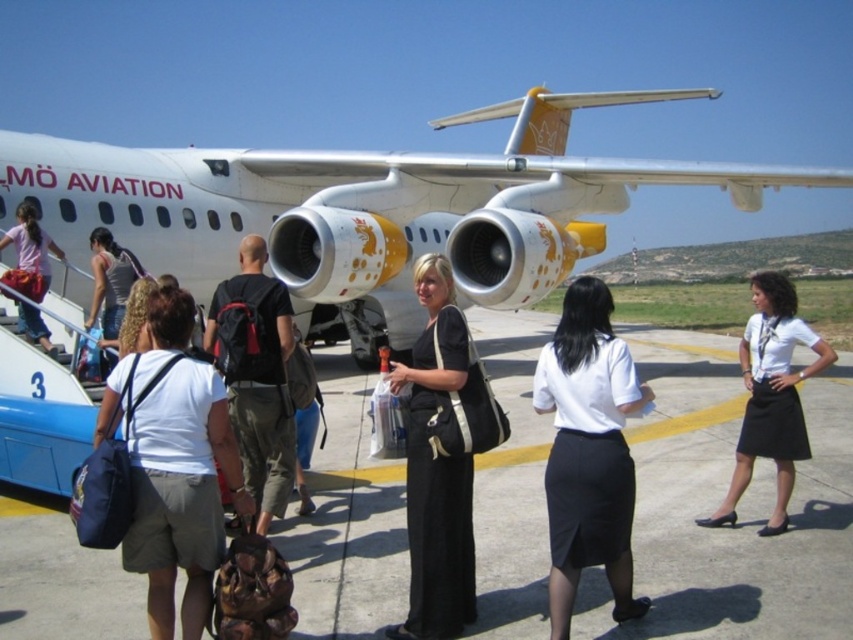
Question: Based on their relative distances, which object is farther from the matte pink shirt at left?

Choices:
 (A) white cotton shirt at center
 (B) white glossy airplane at center
 (C) white smooth shirt at center

Answer: (C)

Question: Which object appears closest to the camera in this image?

Choices:
 (A) white smooth shirt at center
 (B) black fabric dress at center

Answer: (B)

Question: Can you confirm if black fabric dress at center is positioned below black backpack at center?

Choices:
 (A) no
 (B) yes

Answer: (B)

Question: Where is white glossy airplane at center located in relation to matte pink shirt at left in the image?

Choices:
 (A) above
 (B) below

Answer: (A)

Question: Based on their relative distances, which object is nearer to the white smooth shirt at center?

Choices:
 (A) black fabric dress at center
 (B) gray concrete tarmac at center
 (C) matte pink shirt at left
 (D) white cotton shirt at center

Answer: (B)

Question: Does white cotton shirt at center lie in front of matte pink shirt at left?

Choices:
 (A) yes
 (B) no

Answer: (A)